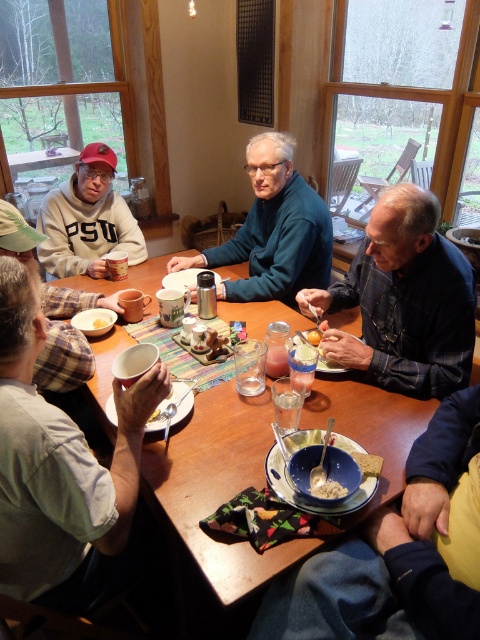
In the scene shown: Is matte blue bowl at center smaller than white matte bowl at center?

No, matte blue bowl at center is not smaller than white matte bowl at center.

Who is more distant from viewer, (282, 472) or (105, 321)?

The point (105, 321) is behind.

The width and height of the screenshot is (480, 640). What are the coordinates of `matte blue bowl at center` in the screenshot? It's located at pyautogui.click(x=312, y=497).

Who is more forward, (71, 269) or (48, 349)?

Point (48, 349)

Where is `matte gray sweatshirt at left`? matte gray sweatshirt at left is located at coordinates (87, 220).

Can you confirm if matte white mug at lower left is bigger than wooden table at center?

No.

Can you confirm if matte white mug at lower left is positioned below wooden table at center?

Indeed, matte white mug at lower left is positioned under wooden table at center.

Who is more distant from viewer, (x=33, y=324) or (x=408, y=442)?

Positioned behind is point (x=408, y=442).

Locate an element on the screen. The image size is (480, 640). matte white mug at lower left is located at coordinates (63, 474).